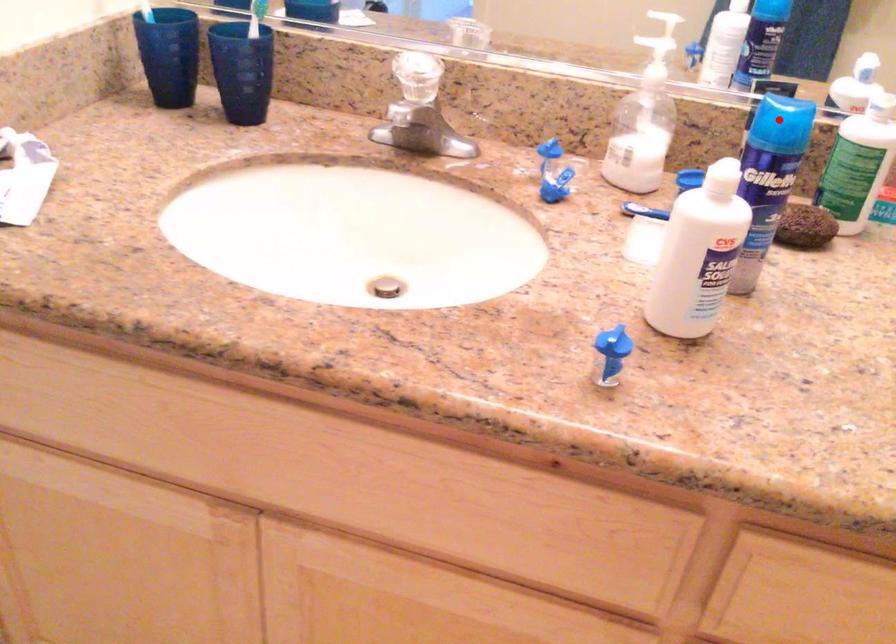
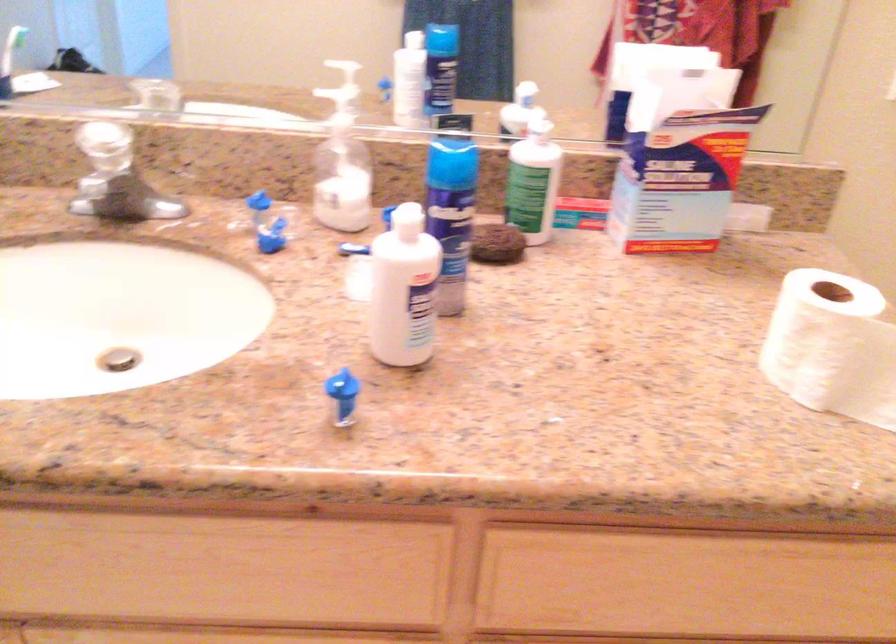
Find the pixel in the second image that matches the highlighted location in the first image.

(451, 158)